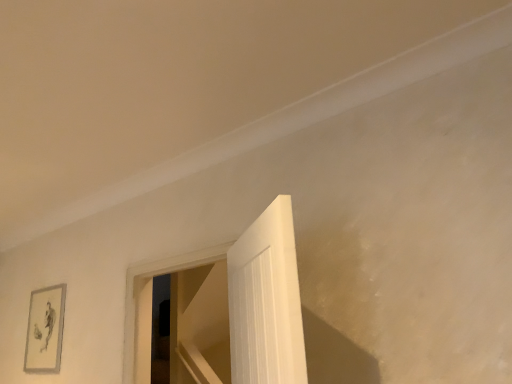
The height and width of the screenshot is (384, 512). What do you see at coordinates (45, 330) in the screenshot?
I see `gray matte picture frame at lower left` at bounding box center [45, 330].

What are the coordinates of `gray matte picture frame at lower left` in the screenshot? It's located at (45, 330).

The image size is (512, 384). What are the coordinates of `gray matte picture frame at lower left` in the screenshot? It's located at (45, 330).